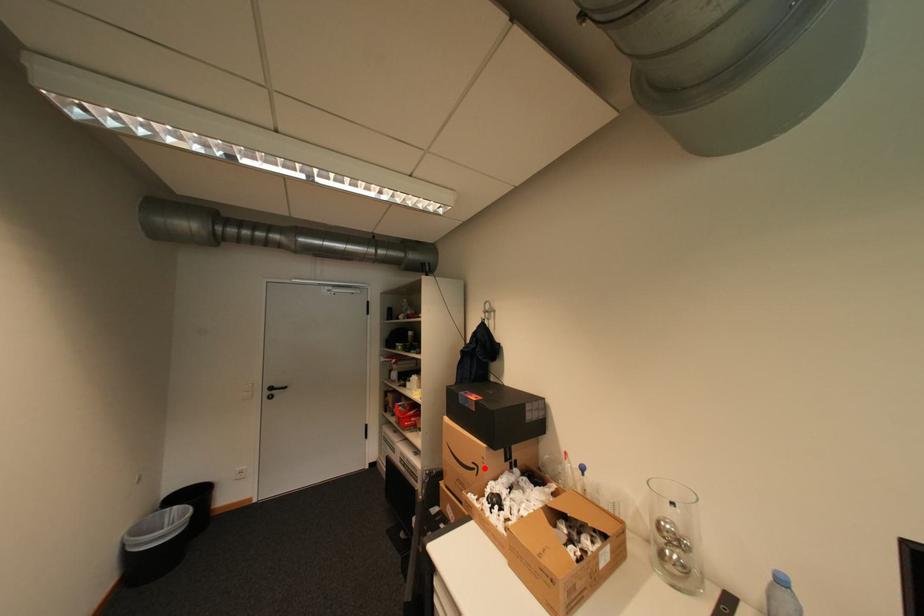
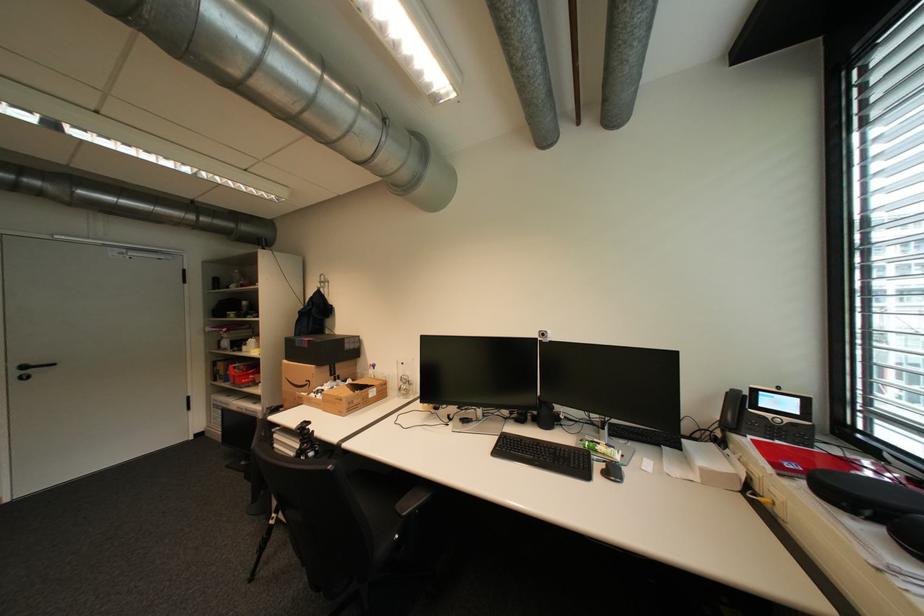
Question: I am providing you with two images of the same scene from different viewpoints. Image1 has a red point marked. In image2, the corresponding 3D location appears at what relative position? Reply with the corresponding letter.

Choices:
 (A) Closer
 (B) Farther

Answer: (A)